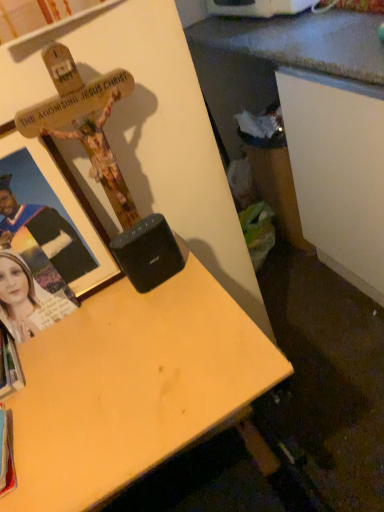
Describe the element at coordinates (57, 211) in the screenshot. The image size is (384, 512). I see `wooden cross at upper left` at that location.

What are the coordinates of `wooden cross at upper left` in the screenshot? It's located at (57, 211).

This screenshot has width=384, height=512. What do you see at coordinates (9, 364) in the screenshot?
I see `white paper book at lower left` at bounding box center [9, 364].

Locate an element on the screen. This screenshot has width=384, height=512. light wood desk at center is located at coordinates (131, 387).

Find the location of a particular element. Image resolution: width=384 pixels, height=512 pixels. matte black photo frame at left is located at coordinates (31, 296).

Between point (146, 259) and point (45, 283), which one is positioned behind?

The point (45, 283) is farther from the camera.

Is black plastic speaker at center inside or outside of matte black photo frame at left?

black plastic speaker at center is not enclosed by matte black photo frame at left.

Looking at this image, is black plastic speaker at center placed right next to matte black photo frame at left?

black plastic speaker at center and matte black photo frame at left are not in contact.

Between black plastic speaker at center and matte black photo frame at left, which one has larger size?

Bigger between the two is matte black photo frame at left.

Could matte black photo frame at left be considered to be inside white paper book at lower left?

No, white paper book at lower left does not contain matte black photo frame at left.

How far apart are white paper book at lower left and matte black photo frame at left?

A distance of 8.99 centimeters exists between white paper book at lower left and matte black photo frame at left.

Is white paper book at lower left oriented away from matte black photo frame at left?

No, white paper book at lower left's orientation is not away from matte black photo frame at left.

Can you tell me how much white paper book at lower left and matte black photo frame at left differ in facing direction?

They differ by 1.98 degrees in their facing directions.

Is white paper book at lower left turned away from wooden cross at upper left?

No, white paper book at lower left's orientation is not away from wooden cross at upper left.

From the image's perspective, is white paper book at lower left under wooden cross at upper left?

Correct, white paper book at lower left appears lower than wooden cross at upper left in the image.

From a real-world perspective, is white paper book at lower left over wooden cross at upper left?

Incorrect, from a real-world perspective, white paper book at lower left is lower than wooden cross at upper left.

From the image's perspective, is light wood desk at center located above or below matte black photo frame at left?

light wood desk at center is below matte black photo frame at left.

Considering the relative sizes of light wood desk at center and matte black photo frame at left in the image provided, is light wood desk at center shorter than matte black photo frame at left?

No.

Which is farther, (65, 381) or (22, 272)?

The point (22, 272) is more distant.

Is white paper book at lower left to the left of light wood desk at center from the viewer's perspective?

Correct, you'll find white paper book at lower left to the left of light wood desk at center.

Which is behind, white paper book at lower left or light wood desk at center?

white paper book at lower left is more distant.

This screenshot has height=512, width=384. I want to click on book on the left of the light wood desk at center, so click(9, 364).

In terms of size, does white paper book at lower left appear bigger or smaller than light wood desk at center?

Considering their sizes, white paper book at lower left takes up less space than light wood desk at center.

Is the position of white paper book at lower left more distant than that of black plastic speaker at center?

That is False.

Is white paper book at lower left far from black plastic speaker at center?

white paper book at lower left is near black plastic speaker at center, not far away.

Can you confirm if white paper book at lower left is wider than black plastic speaker at center?

Yes, white paper book at lower left is wider than black plastic speaker at center.

Which is behind, point (11, 336) or point (148, 251)?

The point (11, 336) is farther.

In terms of size, does matte black photo frame at left appear bigger or smaller than white paper book at lower left?

In the image, matte black photo frame at left appears to be smaller than white paper book at lower left.

Does matte black photo frame at left have a greater height compared to white paper book at lower left?

Correct, matte black photo frame at left is much taller as white paper book at lower left.

Considering the relative positions of matte black photo frame at left and white paper book at lower left in the image provided, is matte black photo frame at left to the left of white paper book at lower left from the viewer's perspective?

No, matte black photo frame at left is not to the left of white paper book at lower left.

Is matte black photo frame at left directly adjacent to white paper book at lower left?

Yes, matte black photo frame at left is right next to white paper book at lower left and making contact.

You are a GUI agent. You are given a task and a screenshot of the screen. Output one action in this format:
    pyautogui.click(x=<x>, y=<y>)
    Task: Click on the speaker behind the matte black photo frame at left
    The image size is (384, 512).
    Given the screenshot: What is the action you would take?
    (x=148, y=253)

Image resolution: width=384 pixels, height=512 pixels. Identify the location of book that appears below the matte black photo frame at left (from the image's perspective). (9, 364).

When comparing their distances from matte black photo frame at left, does white paper book at lower left or light wood desk at center seem closer?

white paper book at lower left is closer to matte black photo frame at left.

When comparing their distances from light wood desk at center, does wooden cross at upper left or black plastic speaker at center seem closer?

Among the two, black plastic speaker at center is located nearer to light wood desk at center.

Looking at the image, which one is located closer to matte black photo frame at left, wooden cross at upper left or light wood desk at center?

wooden cross at upper left lies closer to matte black photo frame at left than the other object.

Considering their positions, is black plastic speaker at center positioned closer to wooden cross at upper left than white paper book at lower left?

black plastic speaker at center is closer to wooden cross at upper left.

Based on their spatial positions, is wooden cross at upper left or light wood desk at center further from black plastic speaker at center?

light wood desk at center is positioned further to the anchor black plastic speaker at center.

Estimate the real-world distances between objects in this image. Which object is further from matte black photo frame at left, light wood desk at center or black plastic speaker at center?

The object further to matte black photo frame at left is light wood desk at center.

Based on their spatial positions, is matte black photo frame at left or black plastic speaker at center further from white paper book at lower left?

Based on the image, black plastic speaker at center appears to be further to white paper book at lower left.

Looking at this image, estimate the real-world distances between objects in this image. Which object is further from black plastic speaker at center, matte black photo frame at left or white paper book at lower left?

Based on the image, white paper book at lower left appears to be further to black plastic speaker at center.

Find the location of a particular element. book between black plastic speaker at center and light wood desk at center from top to bottom is located at coordinates (9, 364).

Where is `person between white paper book at lower left and black plastic speaker at center from left to right`? The height and width of the screenshot is (512, 384). person between white paper book at lower left and black plastic speaker at center from left to right is located at coordinates (31, 296).

Find the location of `book between matte black photo frame at left and light wood desk at center in the up-down direction`. book between matte black photo frame at left and light wood desk at center in the up-down direction is located at coordinates (9, 364).

Image resolution: width=384 pixels, height=512 pixels. I want to click on picture frame situated between white paper book at lower left and black plastic speaker at center from left to right, so click(57, 211).